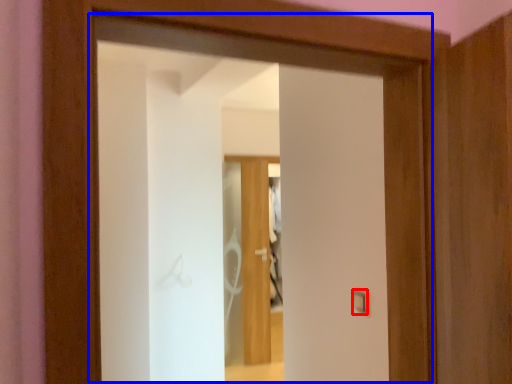
Question: Which object is further to the camera taking this photo, light switch (highlighted by a red box) or door (highlighted by a blue box)?

Choices:
 (A) light switch
 (B) door

Answer: (A)